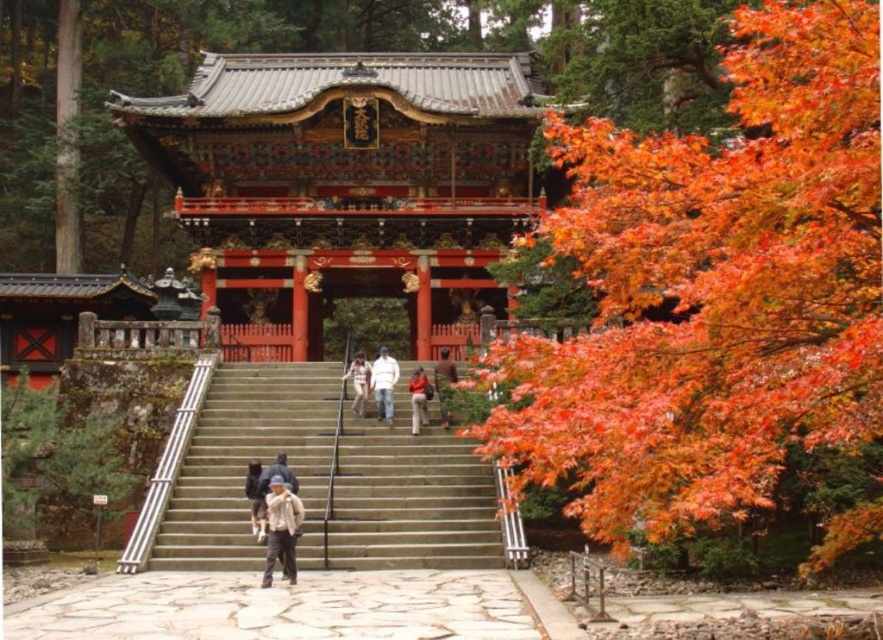
You are standing at the base of the temple steps and want to reach the golden plaque at the center of the temple facade. The point you are currently standing at is labeled as point (x=282, y=561). Given that the distance from this point to the golden plaque is 39.84 meters, can you estimate whether you need to walk more than 40 meters to reach the plaque?

The distance from point (x=282, y=561) to the golden plaque is 39.84 meters, so you do not need to walk more than 40 meters to reach the plaque.

You are standing at the base of the temple steps and see the vivid orange leaves at right and the light brown leather jacket at center. Which object is positioned more to the right side?

The vivid orange leaves at right are positioned to the right of the light brown leather jacket at center, so the vivid orange leaves at right are more to the right.